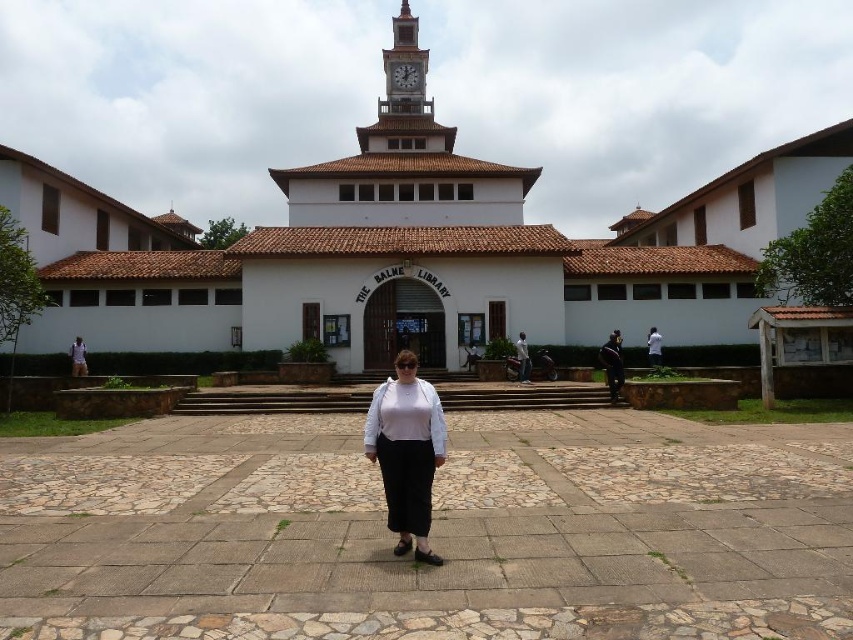
Consider the image. Is brown wooden clock tower at upper center to the left of black fabric at center from the viewer's perspective?

Yes, brown wooden clock tower at upper center is to the left of black fabric at center.

Does brown wooden clock tower at upper center have a smaller size compared to black fabric at center?

No, brown wooden clock tower at upper center is not smaller than black fabric at center.

Find the location of a particular element. brown wooden clock tower at upper center is located at coordinates (404, 65).

Find the location of `brown wooden clock tower at upper center`. brown wooden clock tower at upper center is located at coordinates (404, 65).

Can you confirm if brown wooden clock tower at upper center is wider than matte white shirt at lower left?

In fact, brown wooden clock tower at upper center might be narrower than matte white shirt at lower left.

The width and height of the screenshot is (853, 640). What do you see at coordinates (404, 65) in the screenshot?
I see `brown wooden clock tower at upper center` at bounding box center [404, 65].

Which is in front, point (416, 92) or point (73, 362)?

Point (73, 362) is more forward.

The image size is (853, 640). I want to click on brown wooden clock tower at upper center, so click(404, 65).

Is matte white shirt at center to the right of white shirt at center from the viewer's perspective?

In fact, matte white shirt at center is to the left of white shirt at center.

Does matte white shirt at center have a lesser width compared to white shirt at center?

Indeed, matte white shirt at center has a lesser width compared to white shirt at center.

Between point (527, 365) and point (657, 352), which one is positioned in front?

Point (527, 365) is more forward.

Locate an element on the screen. This screenshot has height=640, width=853. matte white shirt at center is located at coordinates (521, 358).